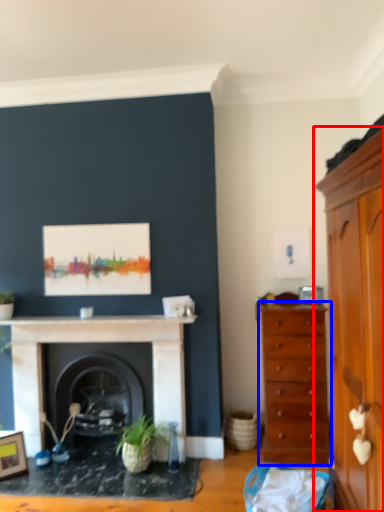
Question: Which object appears closest to the camera in this image, cabinetry (highlighted by a red box) or chest of drawers (highlighted by a blue box)?

Choices:
 (A) cabinetry
 (B) chest of drawers

Answer: (A)